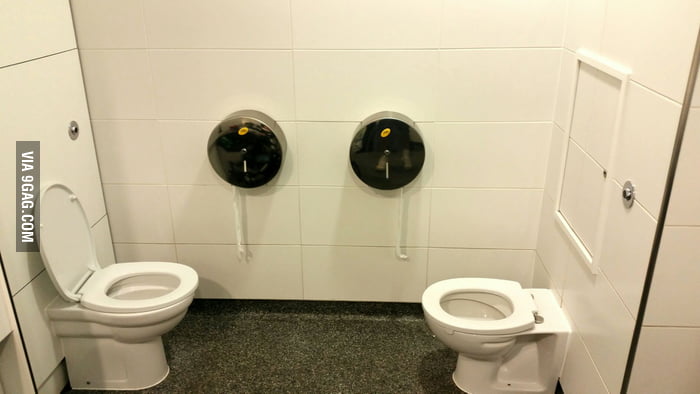
At what (x,y) coordinates should I click in order to perform the action: click on toilet paper. Please return your answer as a coordinate pair (x, y). Image resolution: width=700 pixels, height=394 pixels. Looking at the image, I should click on (237, 216), (400, 212).